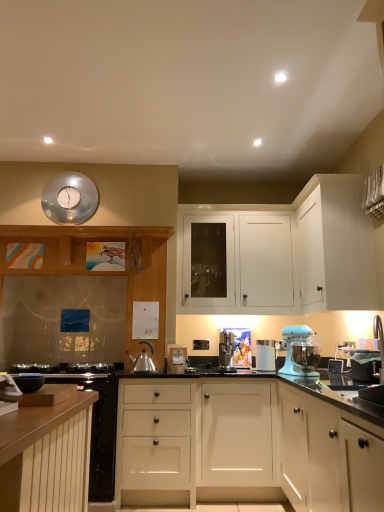
Question: Considering the positions of satin silver coffee machine at center, positioned as the 1th kitchen appliance in left-to-right order, and white matte cabinet at upper right, the fifth cabinetry in the back-to-front sequence, in the image, is satin silver coffee machine at center, positioned as the 1th kitchen appliance in left-to-right order, taller or shorter than white matte cabinet at upper right, the fifth cabinetry in the back-to-front sequence,?

Choices:
 (A) short
 (B) tall

Answer: (A)

Question: From the image's perspective, is satin silver coffee machine at center, positioned as the 1th kitchen appliance in left-to-right order, located above or below white matte cabinet at upper right, the second cabinetry in the front-to-back sequence?

Choices:
 (A) below
 (B) above

Answer: (A)

Question: Estimate the real-world distances between objects in this image. Which object is farther from the light blue plastic stand mixer at center?

Choices:
 (A) wooden cabinet at left, the 5th cabinetry positioned from the front
 (B) shiny metallic kettle at center, the 2th appliance when ordered from right to left
 (C) white matte cabinet at upper right, the second cabinetry in the front-to-back sequence
 (D) white matte cabinet at center, the 3th cabinetry when ordered from back to front
 (E) matte silver toaster at center, the second appliance from the left

Answer: (A)

Question: Estimate the real-world distances between objects in this image. Which object is farther from the wooden cabinet at left, the 2th cabinetry in the back-to-front sequence?

Choices:
 (A) white matte cabinet at lower left, acting as the third cabinetry starting from the front
 (B) metallic reflective clock at upper center
 (C) white matte cabinet at center, the 3th cabinetry when ordered from back to front
 (D) white matte cabinet at upper right, the fifth cabinetry in the back-to-front sequence
 (E) satin silver coffee machine at center, positioned as the 1th kitchen appliance in left-to-right order

Answer: (A)